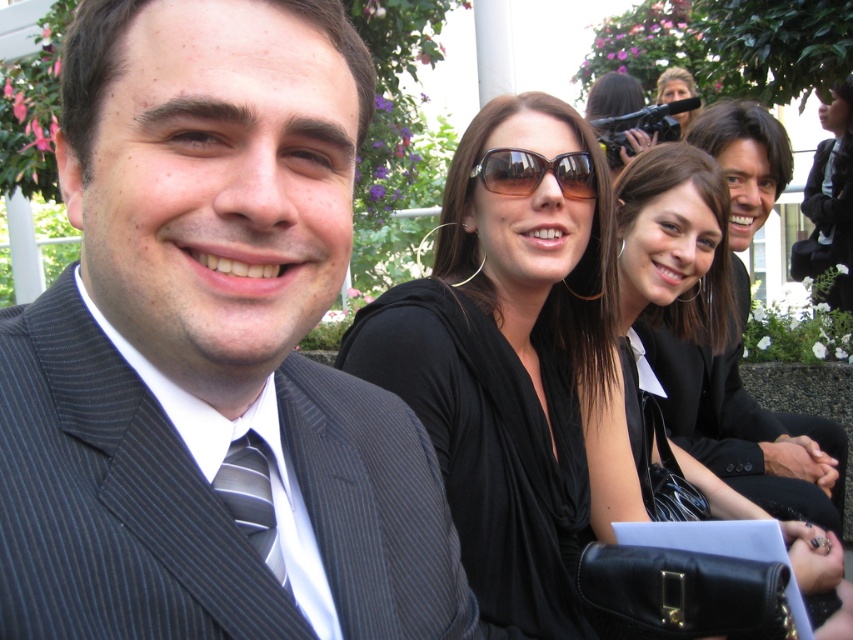
Question: Which is farther from the striped fabric tie at left?

Choices:
 (A) pinstriped suit at center
 (B) black satin dress at center
 (C) brown reflective sunglasses at center
 (D) sunglasses at upper center

Answer: (D)

Question: Does smooth black suit at right appear on the right side of striped fabric tie at left?

Choices:
 (A) yes
 (B) no

Answer: (A)

Question: Is smooth black suit at right to the right of sunglasses at upper center from the viewer's perspective?

Choices:
 (A) no
 (B) yes

Answer: (A)

Question: Which point is farther to the camera?

Choices:
 (A) smooth black suit at right
 (B) black satin dress at center
 (C) sunglasses at upper center

Answer: (C)

Question: Is striped fabric tie at left to the right of sunglasses at upper center from the viewer's perspective?

Choices:
 (A) no
 (B) yes

Answer: (A)

Question: Which object appears closest to the camera in this image?

Choices:
 (A) smooth black suit at right
 (B) sunglasses at upper center
 (C) pinstriped suit at center
 (D) black satin dress at center

Answer: (C)